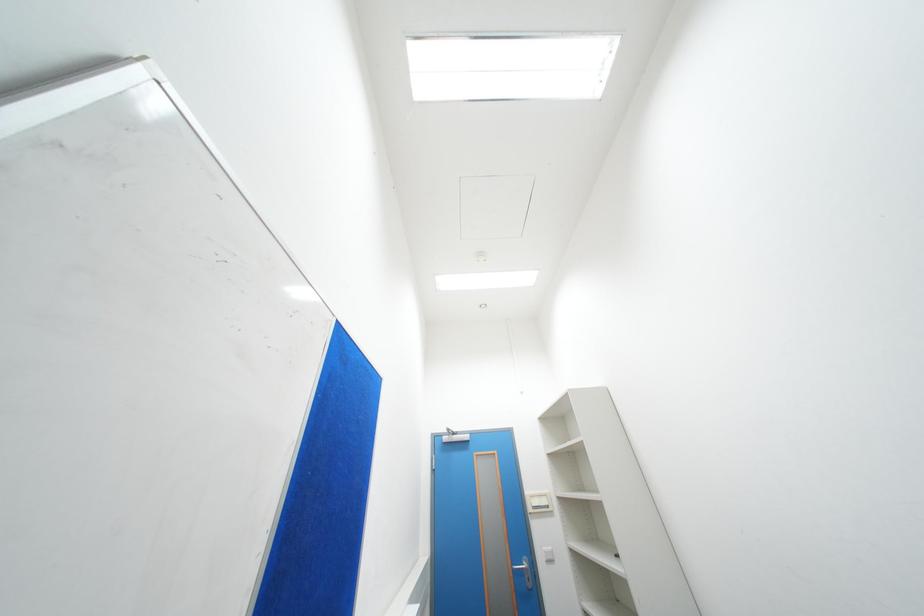
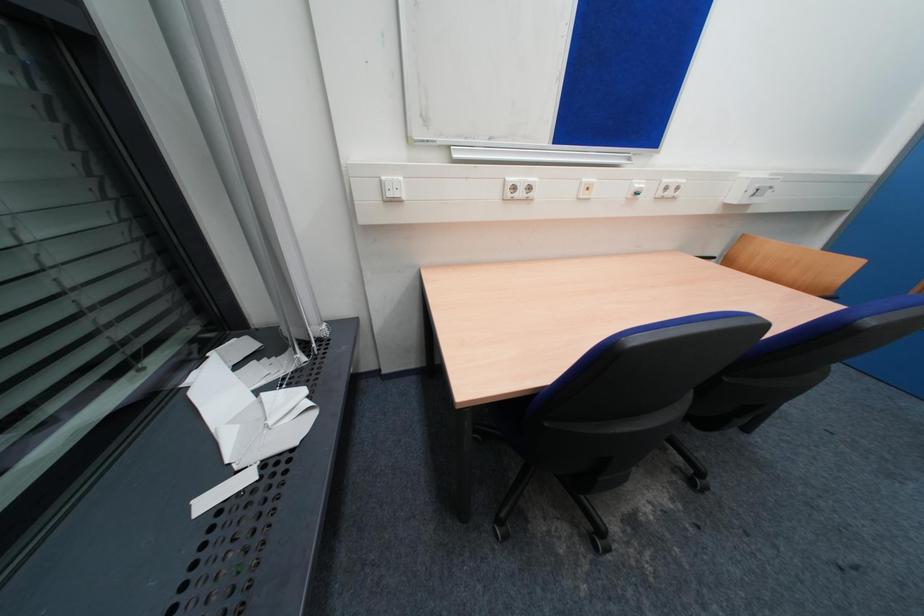
First-person continuous shooting, in which direction is the camera rotating?

The camera rotated toward left-down.